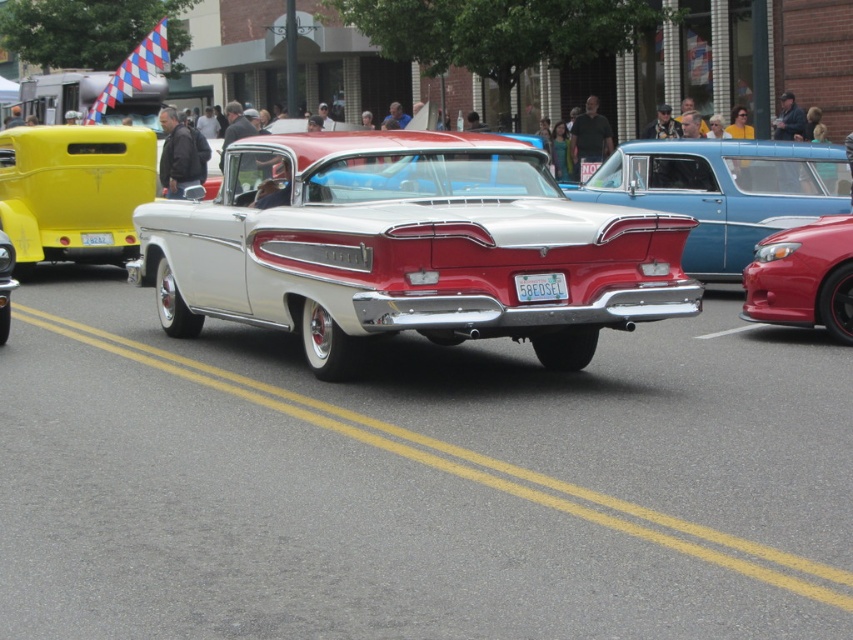
Question: Can you confirm if white glossy car at center is wider than white plastic license plate at center?

Choices:
 (A) no
 (B) yes

Answer: (B)

Question: Can you confirm if white glossy sedan at center is positioned above white plastic license plate at center?

Choices:
 (A) yes
 (B) no

Answer: (A)

Question: Which point appears farthest from the camera in this image?

Choices:
 (A) (297, 163)
 (B) (538, 275)

Answer: (A)

Question: Which point is closer to the camera taking this photo?

Choices:
 (A) (567, 184)
 (B) (479, 234)
 (C) (543, 280)

Answer: (B)

Question: Which point appears farthest from the camera in this image?

Choices:
 (A) click(x=521, y=289)
 (B) click(x=808, y=141)

Answer: (B)

Question: Can you confirm if white glossy car at center is bigger than white glossy sedan at center?

Choices:
 (A) no
 (B) yes

Answer: (B)